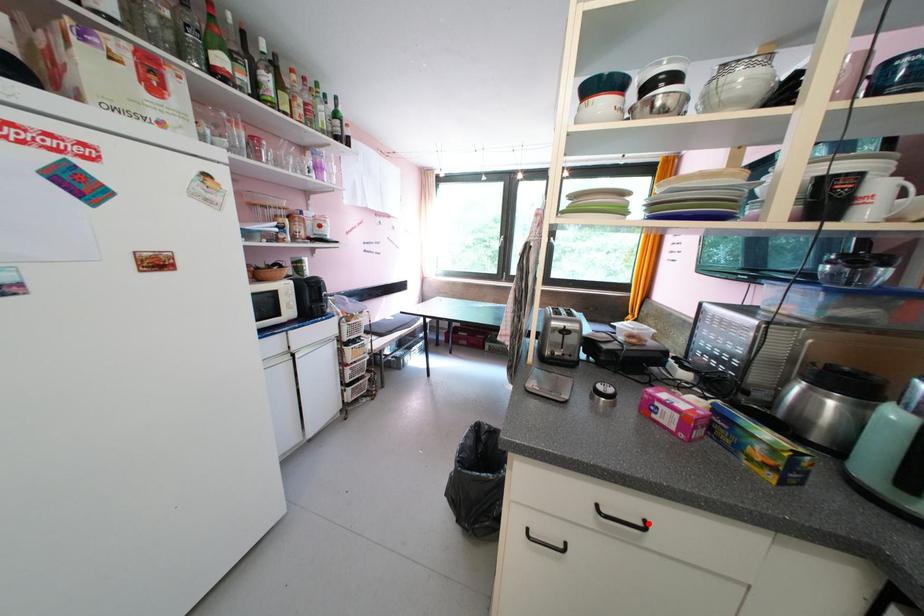
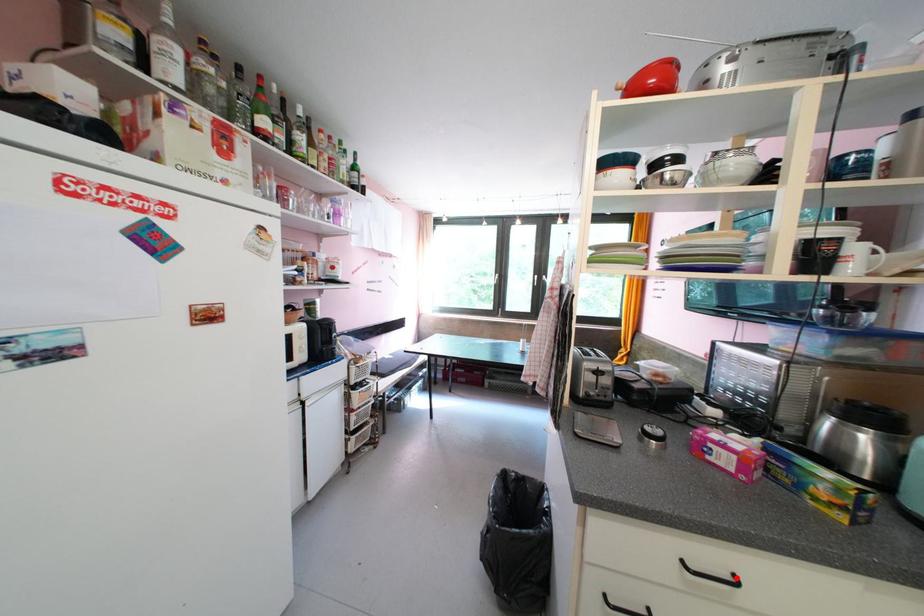
I am providing you with two images of the same scene from different viewpoints. A red point is marked on the first image and another point is marked on the second image. Is the marked point in image1 the same physical position as the marked point in image2?

Yes